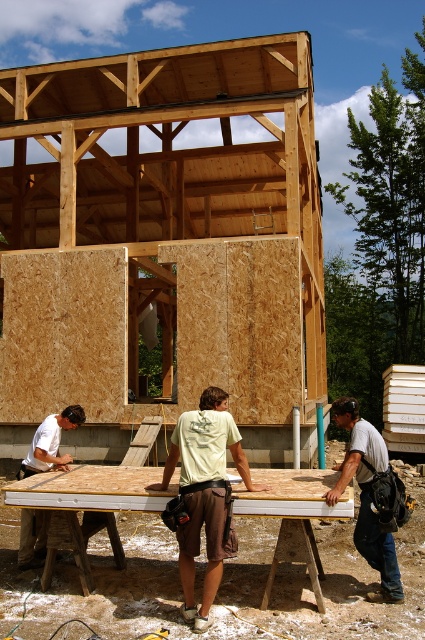
Measure the distance from white matte shirt at center to white shirt at right.

white matte shirt at center is 3.57 feet from white shirt at right.

Does white matte shirt at center appear on the left side of white shirt at right?

Indeed, white matte shirt at center is positioned on the left side of white shirt at right.

Find the location of a particular element. The image size is (425, 640). white matte shirt at center is located at coordinates (204, 496).

Locate an element on the screen. This screenshot has width=425, height=640. white matte shirt at center is located at coordinates (204, 496).